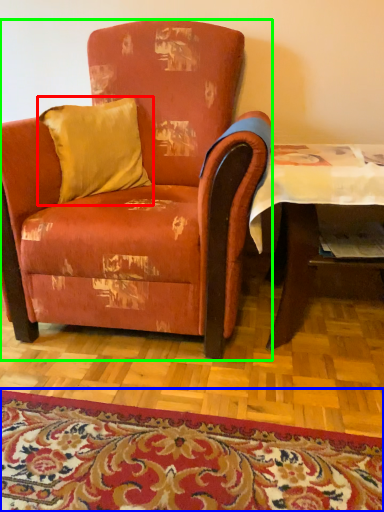
Question: Which object is positioned farthest from pillow (highlighted by a red box)? Select from mat (highlighted by a blue box) and chair (highlighted by a green box).

Choices:
 (A) mat
 (B) chair

Answer: (A)